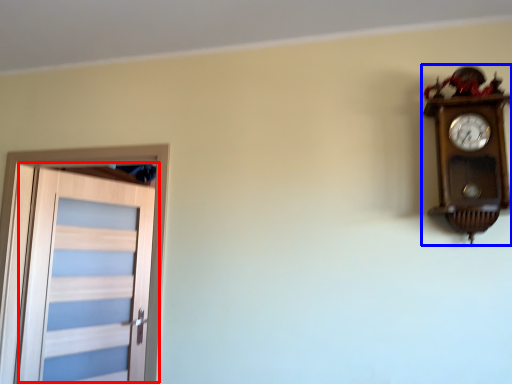
Question: Among these objects, which one is farthest to the camera, door (highlighted by a red box) or wall clock (highlighted by a blue box)?

Choices:
 (A) door
 (B) wall clock

Answer: (A)